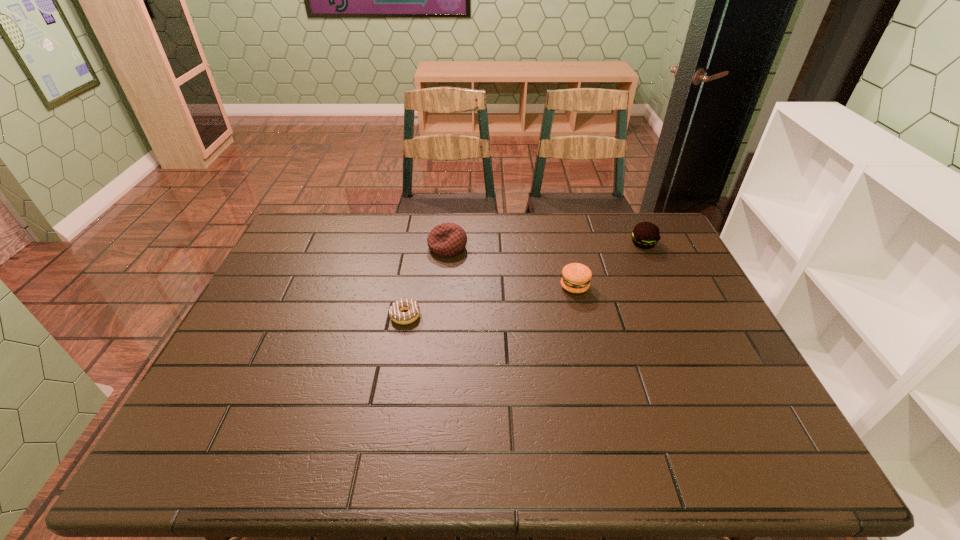
You are a GUI agent. You are given a task and a screenshot of the screen. Output one action in this format:
    pyautogui.click(x=<x>, y=<y>)
    Task: Click on the beanbag
    This screenshot has width=960, height=540.
    Given the screenshot: What is the action you would take?
    pyautogui.click(x=445, y=240)

This screenshot has width=960, height=540. Identify the location of the farther patty. (645, 235).

Locate an element on the screen. The image size is (960, 540). the right patty is located at coordinates (x=645, y=235).

At what (x,y) coordinates should I click in order to perform the action: click on the left patty. Please return your answer as a coordinate pair (x, y). This screenshot has width=960, height=540. Looking at the image, I should click on (576, 277).

You are a GUI agent. You are given a task and a screenshot of the screen. Output one action in this format:
    pyautogui.click(x=<x>, y=<y>)
    Task: Click on the second nearest object
    This screenshot has width=960, height=540.
    Given the screenshot: What is the action you would take?
    click(576, 277)

The width and height of the screenshot is (960, 540). In order to click on the shortest object in this screenshot , I will do `click(413, 310)`.

Locate an element on the screen. the nearest object is located at coordinates (413, 310).

Identify the location of free space located on the back of the beanbag. The height and width of the screenshot is (540, 960). (449, 228).

The height and width of the screenshot is (540, 960). Find the location of `free space located on the front of the rightmost object`. free space located on the front of the rightmost object is located at coordinates (654, 267).

The height and width of the screenshot is (540, 960). Find the location of `blank space located 0.220m on the front of the nearer patty`. blank space located 0.220m on the front of the nearer patty is located at coordinates (591, 355).